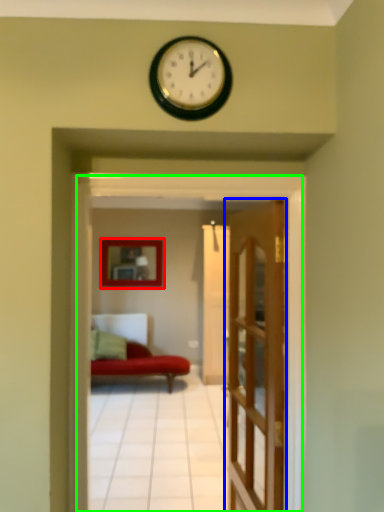
Question: Which object is positioned farthest from picture frame (highlighted by a red box)? Select from door (highlighted by a blue box) and residence (highlighted by a green box).

Choices:
 (A) door
 (B) residence

Answer: (B)